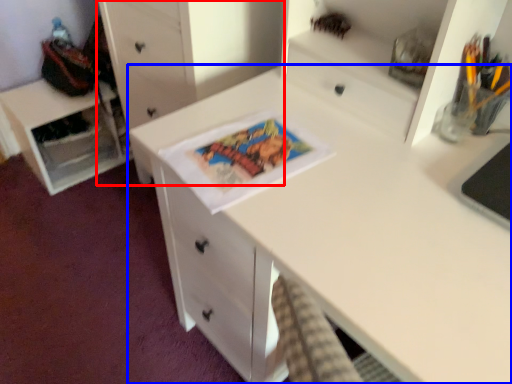
Question: Which point is further to the camera, chest of drawers (highlighted by a red box) or desk (highlighted by a blue box)?

Choices:
 (A) chest of drawers
 (B) desk

Answer: (A)